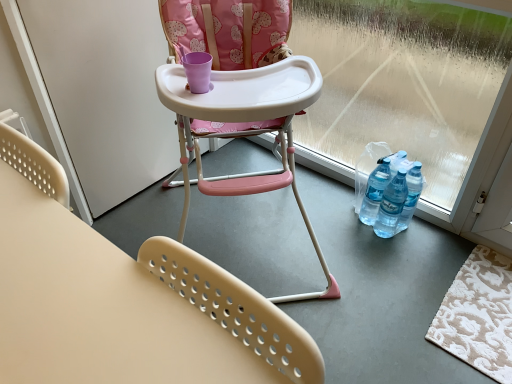
This screenshot has height=384, width=512. What are the coordinates of `pink plastic highchair at center, the 1th chair from the back` in the screenshot? It's located at (228, 31).

Describe the element at coordinates (105, 92) in the screenshot. I see `white matte screen door at left` at that location.

Identify the location of pink plastic highchair at center, the 1th chair from the back. 228,31.

Does point (505, 383) lie behind point (29, 30)?

Yes, it is.

Does beige textured rug at lower right have a smaller size compared to white matte screen door at left?

Yes.

From a real-world perspective, who is located lower, beige textured rug at lower right or white matte screen door at left?

beige textured rug at lower right, from a real-world perspective.

How much distance is there between beige textured rug at lower right and white matte screen door at left?

beige textured rug at lower right and white matte screen door at left are 1.42 meters apart.

Considering the relative sizes of transparent plastic window screen at lower right and beige textured rug at lower right in the image provided, is transparent plastic window screen at lower right thinner than beige textured rug at lower right?

Yes, transparent plastic window screen at lower right is thinner than beige textured rug at lower right.

Is transparent plastic window screen at lower right bigger than beige textured rug at lower right?

Yes, transparent plastic window screen at lower right is bigger than beige textured rug at lower right.

How different are the orientations of transparent plastic window screen at lower right and beige textured rug at lower right in degrees?

0.00221 degrees.

How much distance is there between transparent plastic window screen at lower right and beige textured rug at lower right?

transparent plastic window screen at lower right and beige textured rug at lower right are 25.43 inches apart from each other.

From a real-world perspective, which object rests below the other?

beige plastic chair at lower center, which is counted as the first chair, starting from the front.

Which is in front, beige plastic chair at lower center, which is the 2th chair in back-to-front order, or white matte screen door at left?

beige plastic chair at lower center, which is the 2th chair in back-to-front order, is more forward.

The width and height of the screenshot is (512, 384). Identify the location of the 2nd chair in front of the white matte screen door at left. [x=124, y=299].

Is beige plastic chair at lower center, which is counted as the first chair, starting from the front, looking in the opposite direction of pink plastic highchair at center, the 2th chair when ordered from front to back?

beige plastic chair at lower center, which is counted as the first chair, starting from the front, does not have its back to pink plastic highchair at center, the 2th chair when ordered from front to back.

Considering the relative positions of beige plastic chair at lower center, which is the 2th chair in back-to-front order, and pink plastic highchair at center, the 2th chair when ordered from front to back, in the image provided, is beige plastic chair at lower center, which is the 2th chair in back-to-front order, to the left of pink plastic highchair at center, the 2th chair when ordered from front to back, from the viewer's perspective?

Yes.

From the picture: Would you consider beige plastic chair at lower center, which is the 2th chair in back-to-front order, to be distant from pink plastic highchair at center, the 2th chair when ordered from front to back?

beige plastic chair at lower center, which is the 2th chair in back-to-front order, is actually quite close to pink plastic highchair at center, the 2th chair when ordered from front to back.

From a real-world perspective, is beige plastic chair at lower center, which is the 2th chair in back-to-front order, physically located above or below pink plastic highchair at center, the 2th chair when ordered from front to back?

beige plastic chair at lower center, which is the 2th chair in back-to-front order, is situated lower than pink plastic highchair at center, the 2th chair when ordered from front to back, in the real world.

How distant is beige textured rug at lower right from transparent plastic window screen at lower right?

They are 25.43 inches apart.

What's the angular difference between beige textured rug at lower right and transparent plastic window screen at lower right's facing directions?

The angular difference between beige textured rug at lower right and transparent plastic window screen at lower right is 0.00221 degrees.

Which is more to the left, beige textured rug at lower right or transparent plastic window screen at lower right?

transparent plastic window screen at lower right is more to the left.

From the image's perspective, is beige textured rug at lower right under transparent plastic window screen at lower right?

Yes, from the image's perspective, beige textured rug at lower right is below transparent plastic window screen at lower right.

Does point (3, 247) appear closer or farther from the camera than point (472, 333)?

Point (3, 247) is positioned closer to the camera compared to point (472, 333).

Considering the relative sizes of beige plastic chair at lower center, which is the 2th chair in back-to-front order, and beige textured rug at lower right in the image provided, is beige plastic chair at lower center, which is the 2th chair in back-to-front order, wider than beige textured rug at lower right?

In fact, beige plastic chair at lower center, which is the 2th chair in back-to-front order, might be narrower than beige textured rug at lower right.

Where is `the 1st chair located above the beige textured rug at lower right (from a real-world perspective)`? the 1st chair located above the beige textured rug at lower right (from a real-world perspective) is located at coordinates click(124, 299).

From the image's perspective, is beige plastic chair at lower center, which is counted as the first chair, starting from the front, located above or below beige textured rug at lower right?

Clearly, from the image's perspective, beige plastic chair at lower center, which is counted as the first chair, starting from the front, is below beige textured rug at lower right.

Identify the location of chair that is the 2nd object to the left of the beige textured rug at lower right, starting at the anchor. (124, 299).

Is beige textured rug at lower right to the left or to the right of beige plastic chair at lower center, which is counted as the first chair, starting from the front, in the image?

beige textured rug at lower right is to the right of beige plastic chair at lower center, which is counted as the first chair, starting from the front.

Considering the relative sizes of beige textured rug at lower right and beige plastic chair at lower center, which is counted as the first chair, starting from the front, in the image provided, is beige textured rug at lower right smaller than beige plastic chair at lower center, which is counted as the first chair, starting from the front,?

Indeed, beige textured rug at lower right has a smaller size compared to beige plastic chair at lower center, which is counted as the first chair, starting from the front.

Is the surface of beige textured rug at lower right in direct contact with beige plastic chair at lower center, which is counted as the first chair, starting from the front?

beige textured rug at lower right and beige plastic chair at lower center, which is counted as the first chair, starting from the front, are clearly separated.

Find the location of a particular element. This screenshot has width=512, height=384. mat behind the white matte screen door at left is located at coordinates (478, 315).

The width and height of the screenshot is (512, 384). I want to click on window screen lying above the beige textured rug at lower right (from the image's perspective), so click(403, 81).

Which object lies nearer to the anchor point beige textured rug at lower right, pink plastic highchair at center, the 1th chair from the back, or beige plastic chair at lower center, which is counted as the first chair, starting from the front?

pink plastic highchair at center, the 1th chair from the back.

Looking at this image, from the image, which object appears to be farther from transparent plastic window screen at lower right, white matte screen door at left or beige plastic chair at lower center, which is counted as the first chair, starting from the front?

The object further to transparent plastic window screen at lower right is beige plastic chair at lower center, which is counted as the first chair, starting from the front.

Looking at the image, which one is located further to pink plastic highchair at center, the 2th chair when ordered from front to back, white matte screen door at left or beige plastic chair at lower center, which is counted as the first chair, starting from the front?

Among the two, beige plastic chair at lower center, which is counted as the first chair, starting from the front, is located further to pink plastic highchair at center, the 2th chair when ordered from front to back.

In the scene shown: Looking at the image, which one is located closer to pink plastic highchair at center, the 2th chair when ordered from front to back, beige textured rug at lower right or white matte screen door at left?

white matte screen door at left is closer to pink plastic highchair at center, the 2th chair when ordered from front to back.

From the image, which object appears to be nearer to white matte screen door at left, beige plastic chair at lower center, which is the 2th chair in back-to-front order, or beige textured rug at lower right?

beige plastic chair at lower center, which is the 2th chair in back-to-front order, is closer to white matte screen door at left.

Looking at the image, which one is located closer to white matte screen door at left, beige plastic chair at lower center, which is counted as the first chair, starting from the front, or pink plastic highchair at center, the 1th chair from the back?

pink plastic highchair at center, the 1th chair from the back, is closer to white matte screen door at left.

Considering their positions, is white matte screen door at left positioned further to transparent plastic window screen at lower right than beige textured rug at lower right?

The object further to transparent plastic window screen at lower right is white matte screen door at left.

When comparing their distances from beige textured rug at lower right, does white matte screen door at left or beige plastic chair at lower center, which is counted as the first chair, starting from the front, seem closer?

beige plastic chair at lower center, which is counted as the first chair, starting from the front, is closer to beige textured rug at lower right.

Image resolution: width=512 pixels, height=384 pixels. Find the location of `window screen between white matte screen door at left and beige textured rug at lower right in the horizontal direction`. window screen between white matte screen door at left and beige textured rug at lower right in the horizontal direction is located at coordinates (403, 81).

Identify the location of window screen between pink plastic highchair at center, the 2th chair when ordered from front to back, and beige textured rug at lower right from left to right. (403, 81).

Locate an element on the screen. The width and height of the screenshot is (512, 384). chair between transparent plastic window screen at lower right and beige plastic chair at lower center, which is the 2th chair in back-to-front order, in the up-down direction is located at coordinates (228, 31).

In order to click on chair between beige plastic chair at lower center, which is counted as the first chair, starting from the front, and beige textured rug at lower right, in the horizontal direction in this screenshot , I will do `click(228, 31)`.